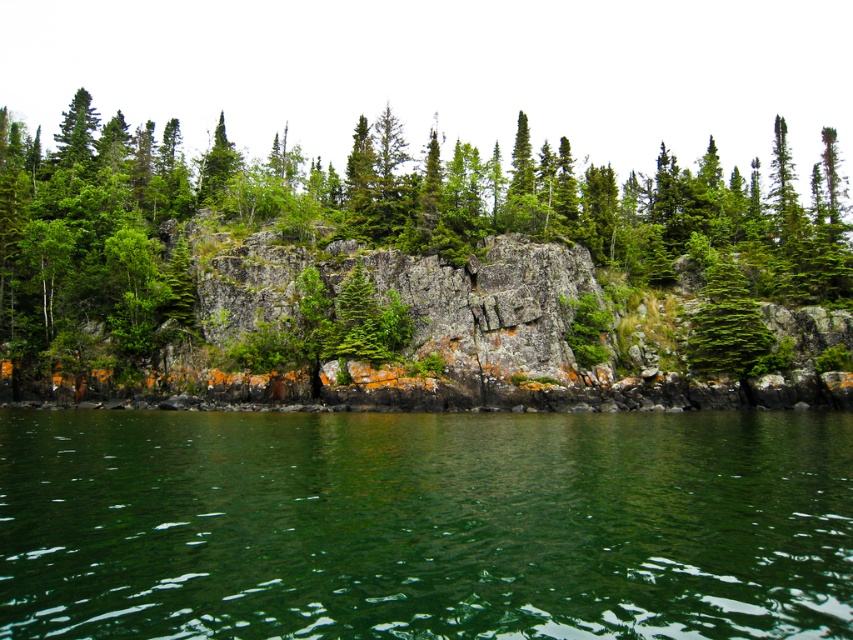
Question: Among these points, which one is farthest from the camera?

Choices:
 (A) (578, 413)
 (B) (462, 205)

Answer: (B)

Question: Among these points, which one is farthest from the camera?

Choices:
 (A) (146, 628)
 (B) (637, 198)

Answer: (B)

Question: Is green liquid at lower center below green matte tree at lower left?

Choices:
 (A) yes
 (B) no

Answer: (A)

Question: Where is green liquid at lower center located in relation to green matte tree at lower left in the image?

Choices:
 (A) right
 (B) left

Answer: (A)

Question: Where is green liquid at lower center located in relation to green matte tree at lower left in the image?

Choices:
 (A) right
 (B) left

Answer: (A)

Question: Which object appears closest to the camera in this image?

Choices:
 (A) green matte tree at lower left
 (B) green liquid at lower center

Answer: (B)